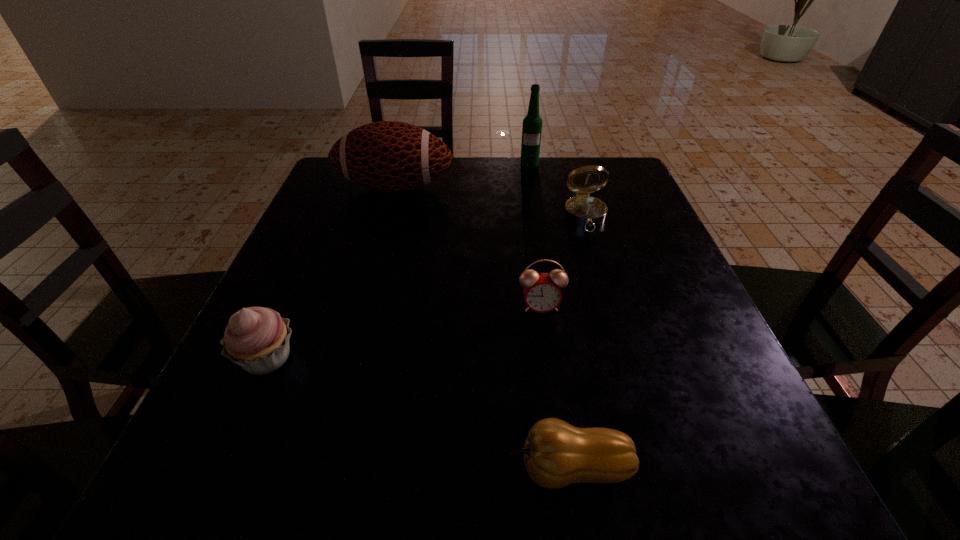
Image resolution: width=960 pixels, height=540 pixels. Identify the location of vacant space located with the dial facing the compass. (609, 293).

Image resolution: width=960 pixels, height=540 pixels. Find the location of `vacant space located 0.110m on the front of the second nearest object`. vacant space located 0.110m on the front of the second nearest object is located at coordinates (225, 454).

Image resolution: width=960 pixels, height=540 pixels. Identify the location of free region located 0.250m on the clock face of the third nearest object. (561, 449).

Locate an element on the screen. free space located on the stem side of the gourd is located at coordinates (286, 468).

Where is `free space located on the stem side of the gourd`? This screenshot has width=960, height=540. free space located on the stem side of the gourd is located at coordinates [362, 468].

Identify the location of vacant space located 0.240m on the stem side of the gourd. (324, 468).

The height and width of the screenshot is (540, 960). Find the location of `beer bottle that is at the far edge`. beer bottle that is at the far edge is located at coordinates (532, 124).

The width and height of the screenshot is (960, 540). I want to click on football that is at the far edge, so click(x=388, y=156).

Where is `compass that is positioned at the far edge`? The height and width of the screenshot is (540, 960). compass that is positioned at the far edge is located at coordinates (582, 210).

At what (x,y) coordinates should I click in order to perform the action: click on object present at the near edge. Please return your answer as a coordinate pair (x, y). Image resolution: width=960 pixels, height=540 pixels. Looking at the image, I should click on (556, 454).